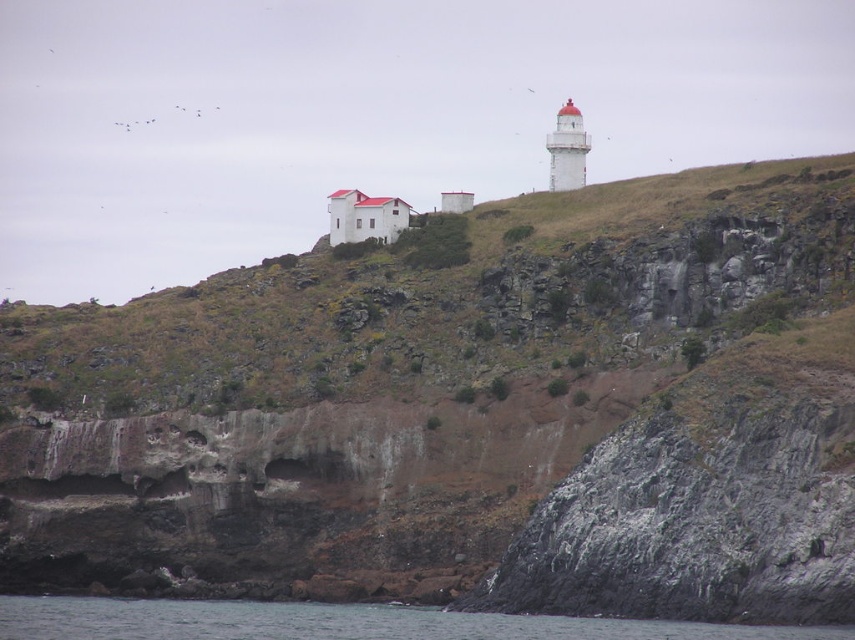
Does transparent blue water at lower left appear under white painted lighthouse at upper right?

Correct, transparent blue water at lower left is located below white painted lighthouse at upper right.

Can you confirm if transparent blue water at lower left is positioned to the left of white painted lighthouse at upper right?

Yes, transparent blue water at lower left is to the left of white painted lighthouse at upper right.

Locate an element on the screen. The height and width of the screenshot is (640, 855). transparent blue water at lower left is located at coordinates (339, 621).

Which is more to the left, brown rocky hillside at upper center or transparent blue water at lower left?

transparent blue water at lower left

Is point (669, 317) in front of point (299, 614)?

No, it is behind (299, 614).

Locate an element on the screen. brown rocky hillside at upper center is located at coordinates (446, 296).

Is point (89, 387) positioned behind point (564, 120)?

That is False.

Between brown rocky hillside at upper center and white painted lighthouse at upper right, which one appears on the right side from the viewer's perspective?

white painted lighthouse at upper right is more to the right.

This screenshot has height=640, width=855. What are the coordinates of `brown rocky hillside at upper center` in the screenshot? It's located at (446, 296).